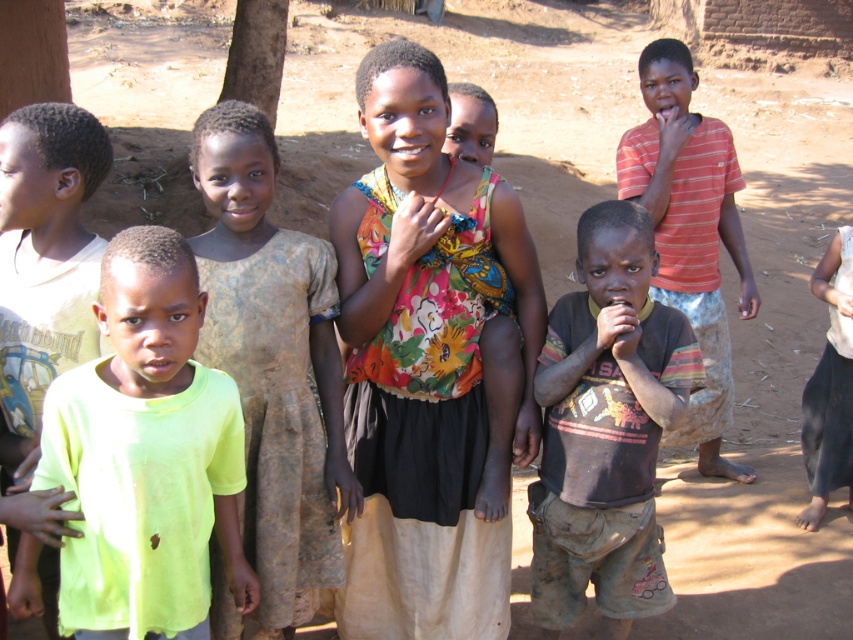
Please look at the image and identify the object located at the coordinates point (273, 364). What is it?

The object at point (273, 364) is the brown textured dress at center.

You are a photographer trying to capture a group photo of the children. The floral fabric dress at center and the dirty brown shirt at center are both in the frame. Which child should you ask to move closer to avoid their clothing from overlapping too much with others?

The floral fabric dress at center has a larger width than the dirty brown shirt at center, so you should ask the child wearing the floral fabric dress at center to move closer to prevent their wider clothing from overlapping others.